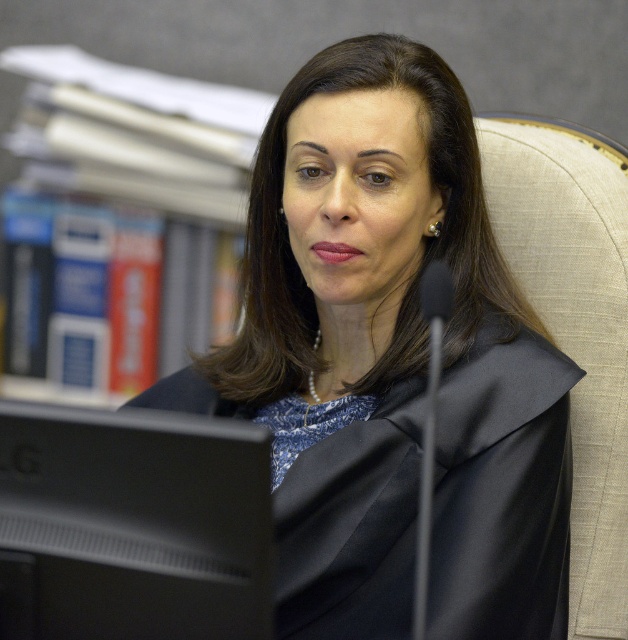
You are an interior designer who needs to ensure that all items in the room are arranged to meet safety standards. According to the scene, which object, the matte black robe at center or the black matte monitor at lower left, is positioned higher and therefore poses a potential falling hazard if not secured?

The matte black robe at center is much taller than the black matte monitor at lower left, so it poses a potential falling hazard if not secured.